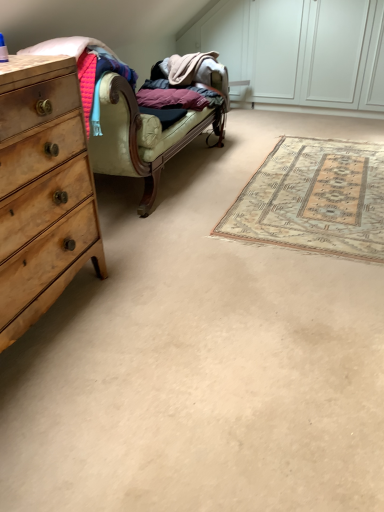
Question: Considering the relative sizes of beige woven rug at center and velvet green couch at center in the image provided, is beige woven rug at center bigger than velvet green couch at center?

Choices:
 (A) no
 (B) yes

Answer: (A)

Question: Are beige woven rug at center and velvet green couch at center located far from each other?

Choices:
 (A) yes
 (B) no

Answer: (B)

Question: Can you see beige woven rug at center touching velvet green couch at center?

Choices:
 (A) yes
 (B) no

Answer: (B)

Question: Does beige woven rug at center have a lesser width compared to velvet green couch at center?

Choices:
 (A) yes
 (B) no

Answer: (B)

Question: From the image's perspective, is beige woven rug at center on velvet green couch at center?

Choices:
 (A) no
 (B) yes

Answer: (A)

Question: Is beige woven rug at center shorter than velvet green couch at center?

Choices:
 (A) yes
 (B) no

Answer: (A)

Question: Is beige woven rug at center directly adjacent to wooden chest of drawers at left?

Choices:
 (A) no
 (B) yes

Answer: (A)

Question: Could wooden chest of drawers at left be considered to be inside beige woven rug at center?

Choices:
 (A) yes
 (B) no

Answer: (B)

Question: Considering the relative sizes of beige woven rug at center and wooden chest of drawers at left in the image provided, is beige woven rug at center thinner than wooden chest of drawers at left?

Choices:
 (A) yes
 (B) no

Answer: (B)

Question: Can you confirm if beige woven rug at center is bigger than wooden chest of drawers at left?

Choices:
 (A) no
 (B) yes

Answer: (A)

Question: From a real-world perspective, is beige woven rug at center located beneath wooden chest of drawers at left?

Choices:
 (A) no
 (B) yes

Answer: (B)

Question: Is beige woven rug at center turned away from wooden chest of drawers at left?

Choices:
 (A) yes
 (B) no

Answer: (B)

Question: Is wooden chest of drawers at left not inside beige woven rug at center?

Choices:
 (A) no
 (B) yes

Answer: (B)